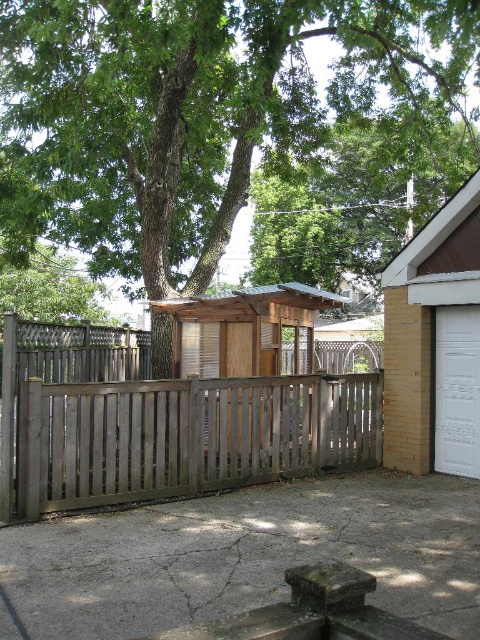
Question: Which object appears closest to the camera in this image?

Choices:
 (A) wooden shed at center
 (B) green leafy tree at upper center
 (C) white glossy garage door at right

Answer: (B)

Question: Which of the following is the closest to the observer?

Choices:
 (A) brown wood cabin at upper right
 (B) weathered wood fence at center

Answer: (B)

Question: Which of the following is the closest to the observer?

Choices:
 (A) (385, 422)
 (B) (275, 401)
 (C) (295, 284)

Answer: (B)

Question: Is brown wood cabin at upper right positioned in front of white glossy garage door at right?

Choices:
 (A) yes
 (B) no

Answer: (A)

Question: Is green leafy tree at upper center in front of brown wood cabin at upper right?

Choices:
 (A) yes
 (B) no

Answer: (A)

Question: From the image, what is the correct spatial relationship of weathered wood fence at center in relation to wooden shed at center?

Choices:
 (A) left
 (B) right

Answer: (A)